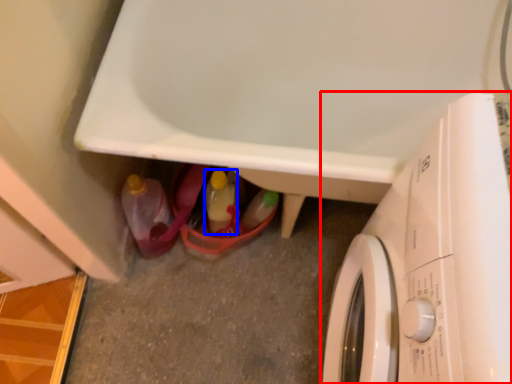
Question: Which point is further to the camera, washing machine (highlighted by a red box) or bottle (highlighted by a blue box)?

Choices:
 (A) washing machine
 (B) bottle

Answer: (B)